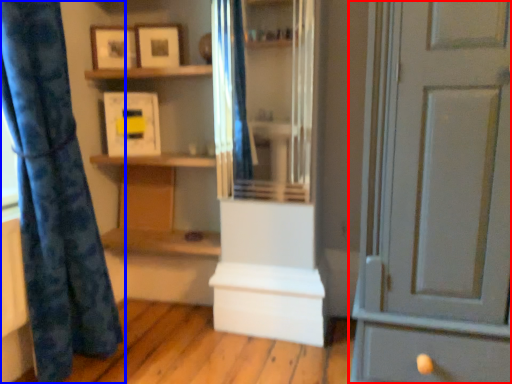
Question: Which of the following is the farthest to the observer, door (highlighted by a red box) or curtain (highlighted by a blue box)?

Choices:
 (A) door
 (B) curtain

Answer: (B)